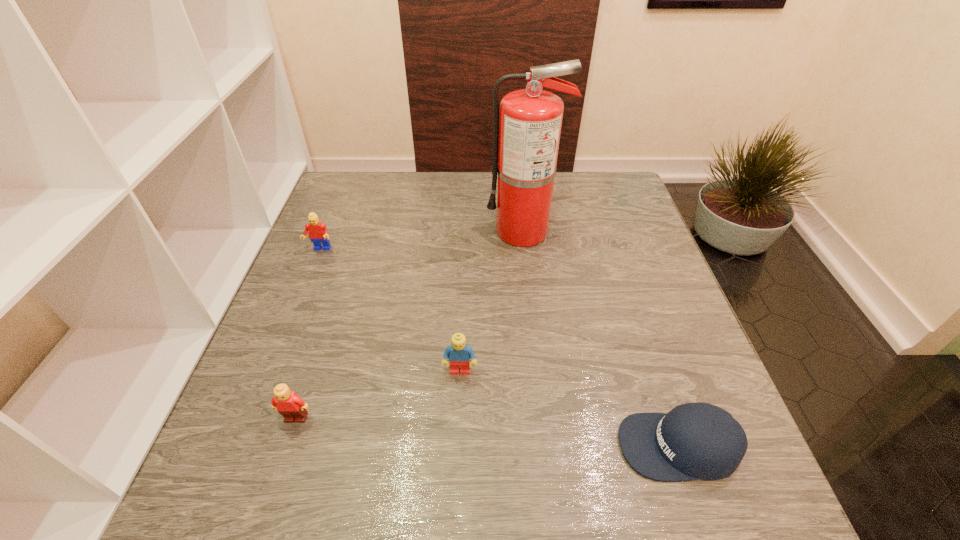
The height and width of the screenshot is (540, 960). I want to click on the tallest object, so click(x=528, y=135).

At what (x,y) coordinates should I click in order to perform the action: click on the fourth object from left to right. Please return your answer as a coordinate pair (x, y). The height and width of the screenshot is (540, 960). Looking at the image, I should click on (528, 135).

You are a GUI agent. You are given a task and a screenshot of the screen. Output one action in this format:
    pyautogui.click(x=<x>, y=<y>)
    Task: Click on the leftmost object
    The width and height of the screenshot is (960, 540).
    Given the screenshot: What is the action you would take?
    pyautogui.click(x=317, y=231)

Identify the location of the farthest Lego. (317, 231).

You are a GUI agent. You are given a task and a screenshot of the screen. Output one action in this format:
    pyautogui.click(x=<x>, y=<y>)
    Task: Click on the rightmost Lego
    Image resolution: width=960 pixels, height=540 pixels.
    Given the screenshot: What is the action you would take?
    pyautogui.click(x=459, y=353)

Where is `the second nearest Lego`? The width and height of the screenshot is (960, 540). the second nearest Lego is located at coordinates (459, 353).

The width and height of the screenshot is (960, 540). I want to click on the nearest Lego, so click(292, 407).

You are a GUI agent. You are given a task and a screenshot of the screen. Output one action in this format:
    pyautogui.click(x=<x>, y=<y>)
    Task: Click on the second object from left to right
    Image resolution: width=960 pixels, height=540 pixels.
    Given the screenshot: What is the action you would take?
    pyautogui.click(x=292, y=407)

This screenshot has width=960, height=540. Identify the location of the shortest object. (699, 440).

Where is `baseball cap`? baseball cap is located at coordinates (699, 440).